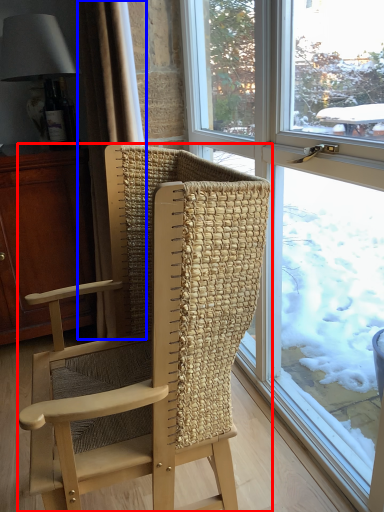
Question: Which object appears farthest to the camera in this image, chair (highlighted by a red box) or curtain (highlighted by a blue box)?

Choices:
 (A) chair
 (B) curtain

Answer: (B)